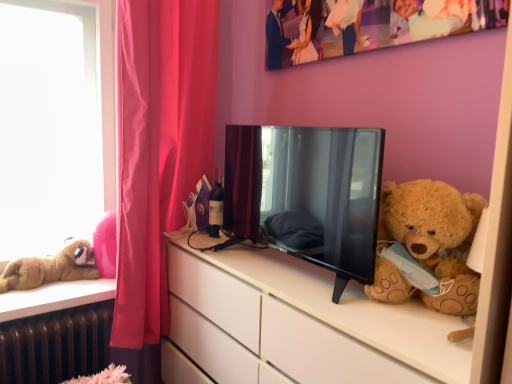
At what (x,y) coordinates should I click in order to perform the action: click on brown metallic radiator at lower left. Please return your answer as a coordinate pair (x, y). The image size is (512, 384). Looking at the image, I should click on (56, 345).

Locate an element on the screen. black glossy tv at center is located at coordinates (307, 193).

Find the location of a particular element. brown metallic radiator at lower left is located at coordinates (56, 345).

Is point (79, 278) closer or farther from the camera than point (462, 236)?

Point (79, 278) is positioned farther from the camera compared to point (462, 236).

From the picture: Considering the sizes of objects soft brown plush at left, arranged as the 2th teddy bear when viewed from the right, and fluffy brown teddy bear at right, the 2th teddy bear positioned from the back, in the image provided, who is bigger, soft brown plush at left, arranged as the 2th teddy bear when viewed from the right, or fluffy brown teddy bear at right, the 2th teddy bear positioned from the back,?

With larger size is fluffy brown teddy bear at right, the 2th teddy bear positioned from the back.

In the image, is soft brown plush at left, which ranks as the 1th teddy bear in back-to-front order, on the left side or the right side of fluffy brown teddy bear at right, acting as the first teddy bear starting from the front?

Clearly, soft brown plush at left, which ranks as the 1th teddy bear in back-to-front order, is on the left of fluffy brown teddy bear at right, acting as the first teddy bear starting from the front, in the image.

Is matte pink curtain at left wider than brown metallic radiator at lower left?

Indeed, matte pink curtain at left has a greater width compared to brown metallic radiator at lower left.

Which is farther from the camera, (213, 69) or (29, 330)?

The point (213, 69) is behind.

In the image, is matte pink curtain at left positioned in front of or behind brown metallic radiator at lower left?

matte pink curtain at left is positioned closer to the viewer than brown metallic radiator at lower left.

Considering the sizes of matte pink curtain at left and brown metallic radiator at lower left in the image, is matte pink curtain at left taller or shorter than brown metallic radiator at lower left?

Clearly, matte pink curtain at left is taller compared to brown metallic radiator at lower left.

Can you confirm if white matte cabinet at right is bigger than pink rubber ball at left?

Indeed, white matte cabinet at right has a larger size compared to pink rubber ball at left.

Is white matte cabinet at right not within pink rubber ball at left?

Yes, white matte cabinet at right is located beyond the bounds of pink rubber ball at left.

Does white matte cabinet at right come in front of pink rubber ball at left?

Yes, it is in front of pink rubber ball at left.

From a real-world perspective, which object stands above the other?

pink rubber ball at left.

How different are the orientations of soft brown plush at left, which ranks as the 1th teddy bear in back-to-front order, and brown metallic radiator at lower left in degrees?

4.03 degrees.

From a real-world perspective, is soft brown plush at left, acting as the 1th teddy bear starting from the left, physically above brown metallic radiator at lower left?

Yes.

Is soft brown plush at left, acting as the 1th teddy bear starting from the left, oriented towards brown metallic radiator at lower left?

No, soft brown plush at left, acting as the 1th teddy bear starting from the left, is not turned towards brown metallic radiator at lower left.

Is brown metallic radiator at lower left completely or partially inside soft brown plush at left, arranged as the 2th teddy bear when viewed from the right?

No, soft brown plush at left, arranged as the 2th teddy bear when viewed from the right, does not contain brown metallic radiator at lower left.

Which is closer, (419,275) or (100,238)?

Clearly, point (419,275) is closer to the camera than point (100,238).

Can you confirm if fluffy brown teddy bear at right, the 2th teddy bear when ordered from left to right, is wider than pink rubber ball at left?

Yes.

Could you measure the distance between fluffy brown teddy bear at right, the 2th teddy bear when ordered from left to right, and pink rubber ball at left?

fluffy brown teddy bear at right, the 2th teddy bear when ordered from left to right, is 3.82 feet from pink rubber ball at left.

Where is `toy below the fluffy brown teddy bear at right, the 2th teddy bear positioned from the back (from the image's perspective)`? Image resolution: width=512 pixels, height=384 pixels. toy below the fluffy brown teddy bear at right, the 2th teddy bear positioned from the back (from the image's perspective) is located at coordinates (106, 245).

In the scene shown: Can you confirm if brown metallic radiator at lower left is bigger than matte glass bottle at center?

Yes.

At what (x,y) coordinates should I click in order to perform the action: click on bottle behind the brown metallic radiator at lower left. Please return your answer as a coordinate pair (x, y). The width and height of the screenshot is (512, 384). Looking at the image, I should click on (216, 207).

Is brown metallic radiator at lower left outside of matte glass bottle at center?

That's correct, brown metallic radiator at lower left is outside of matte glass bottle at center.

Is point (18, 365) in front of point (217, 230)?

Yes, point (18, 365) is in front of point (217, 230).

Is pink rubber ball at left a part of brown metallic radiator at lower left?

That's incorrect, pink rubber ball at left is not inside brown metallic radiator at lower left.

The height and width of the screenshot is (384, 512). Identify the location of toy lying behind the brown metallic radiator at lower left. (106, 245).

From a real-world perspective, is brown metallic radiator at lower left located higher than pink rubber ball at left?

Actually, brown metallic radiator at lower left is physically below pink rubber ball at left in the real world.

How far apart are brown metallic radiator at lower left and pink rubber ball at left?

brown metallic radiator at lower left and pink rubber ball at left are 12.29 inches apart.

Where is `teddy bear lying on the right of soft brown plush at left, arranged as the 2th teddy bear when viewed from the right`? This screenshot has width=512, height=384. teddy bear lying on the right of soft brown plush at left, arranged as the 2th teddy bear when viewed from the right is located at coordinates (428, 248).

Identify the location of radiator behind the matte pink curtain at left. The width and height of the screenshot is (512, 384). (56, 345).

Looking at the image, which one is located further to black glossy tv at center, matte glass bottle at center or white matte cabinet at right?

Based on the image, matte glass bottle at center appears to be further to black glossy tv at center.

Based on their spatial positions, is matte glass bottle at center or soft brown plush at left, marked as the 2th teddy bear in a front-to-back arrangement, further from black glossy tv at center?

Based on the image, soft brown plush at left, marked as the 2th teddy bear in a front-to-back arrangement, appears to be further to black glossy tv at center.

Estimate the real-world distances between objects in this image. Which object is further from matte glass bottle at center, white matte cabinet at right or soft brown plush at left, which ranks as the 1th teddy bear in back-to-front order?

soft brown plush at left, which ranks as the 1th teddy bear in back-to-front order, is positioned further to the anchor matte glass bottle at center.

From the image, which object appears to be nearer to soft brown plush at left, acting as the 1th teddy bear starting from the left, black glossy tv at center or brown metallic radiator at lower left?

Based on the image, brown metallic radiator at lower left appears to be nearer to soft brown plush at left, acting as the 1th teddy bear starting from the left.

From the image, which object appears to be farther from soft brown plush at left, acting as the 1th teddy bear starting from the left, brown metallic radiator at lower left or pink rubber ball at left?

brown metallic radiator at lower left is further to soft brown plush at left, acting as the 1th teddy bear starting from the left.

Considering their positions, is white matte cabinet at right positioned further to matte pink curtain at left than brown metallic radiator at lower left?

Based on the image, white matte cabinet at right appears to be further to matte pink curtain at left.

Looking at the image, which one is located further to pink rubber ball at left, matte pink curtain at left or fluffy brown teddy bear at right, the 2th teddy bear when ordered from left to right?

Based on the image, fluffy brown teddy bear at right, the 2th teddy bear when ordered from left to right, appears to be further to pink rubber ball at left.

When comparing their distances from brown metallic radiator at lower left, does white matte cabinet at right or matte glass bottle at center seem further?

matte glass bottle at center is further to brown metallic radiator at lower left.

Identify the location of television situated between pink rubber ball at left and fluffy brown teddy bear at right, acting as the first teddy bear starting from the front, from left to right. (307, 193).

The height and width of the screenshot is (384, 512). I want to click on curtain between pink rubber ball at left and matte glass bottle at center, so click(x=158, y=147).

What are the coordinates of `television between fluffy brown teddy bear at right, the 2th teddy bear when ordered from left to right, and matte glass bottle at center, along the z-axis` in the screenshot? It's located at (307, 193).

At what (x,y) coordinates should I click in order to perform the action: click on teddy bear between pink rubber ball at left and brown metallic radiator at lower left from top to bottom. Please return your answer as a coordinate pair (x, y). Looking at the image, I should click on (51, 267).